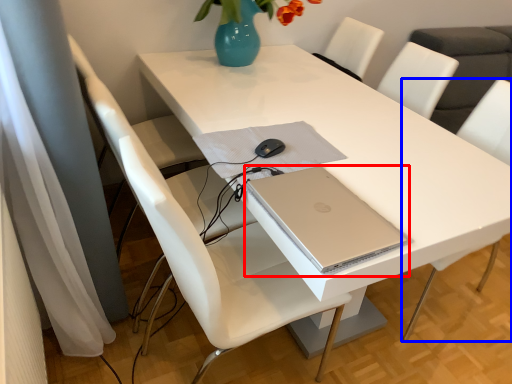
Question: Which object appears farthest to the camera in this image, computer (highlighted by a red box) or chair (highlighted by a blue box)?

Choices:
 (A) computer
 (B) chair

Answer: (B)